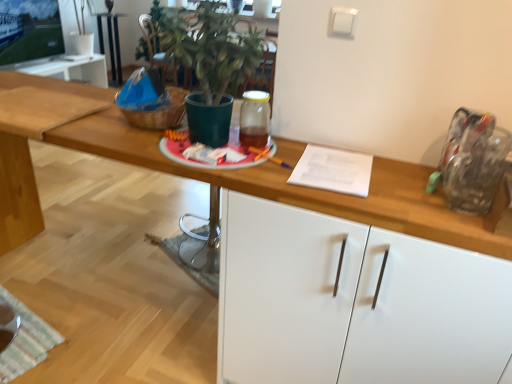
Describe the element at coordinates (354, 303) in the screenshot. I see `white glossy cabinet at center` at that location.

Find the location of a particular element. The image size is (512, 384). metallic silver table at center is located at coordinates coord(111,43).

Identify the location of white glossy cabinet at center. (354, 303).

Is white glossy cabinet at center spatially inside green matte plant pot at center, or outside of it?

white glossy cabinet at center is not inside green matte plant pot at center, it's outside.

Is white glossy cabinet at center smaller than green matte plant pot at center?

No.

Can you confirm if white glossy cabinet at center is thinner than green matte plant pot at center?

In fact, white glossy cabinet at center might be wider than green matte plant pot at center.

Is point (251, 208) closer or farther from the camera than point (229, 37)?

Point (251, 208) appears to be closer to the viewer than point (229, 37).

Is there a large distance between metallic silver table at center and white glossy cabinet at center?

Yes.

Does metallic silver table at center have a greater height compared to white glossy cabinet at center?

Answer: In fact, metallic silver table at center may be shorter than white glossy cabinet at center.

From a real-world perspective, is metallic silver table at center positioned above or below white glossy cabinet at center?

In terms of real-world spatial position, metallic silver table at center is below white glossy cabinet at center.

Is metallic silver table at center situated inside white glossy cabinet at center or outside?

metallic silver table at center is outside white glossy cabinet at center.

From the image's perspective, which object appears higher, green matte plant pot at center or metallic silver table at center?

From the image's view, metallic silver table at center is above.

From a real-world perspective, is green matte plant pot at center on top of metallic silver table at center?

Correct, in the physical world, green matte plant pot at center is higher than metallic silver table at center.

Between green matte plant pot at center and metallic silver table at center, which one appears on the right side from the viewer's perspective?

green matte plant pot at center.

Locate an element on the screen. The width and height of the screenshot is (512, 384). table located on the left of green matte plant pot at center is located at coordinates (111, 43).

Does green matte plant pot at center turn towards white glossy cabinet at center?

No.

Is green matte plant pot at center inside the boundaries of white glossy cabinet at center, or outside?

green matte plant pot at center exists outside the volume of white glossy cabinet at center.

From the image's perspective, is green matte plant pot at center above or below white glossy cabinet at center?

From the image's perspective, green matte plant pot at center appears above white glossy cabinet at center.

From a real-world perspective, relative to white glossy cabinet at center, is green matte plant pot at center vertically above or below?

In terms of real-world spatial position, green matte plant pot at center is above white glossy cabinet at center.

Does point (98, 14) appear closer or farther from the camera than point (224, 20)?

Point (98, 14) appears to be farther away from the viewer than point (224, 20).

Which of these two, metallic silver table at center or green matte plant pot at center, stands shorter?

Standing shorter between the two is green matte plant pot at center.

How different are the orientations of metallic silver table at center and green matte plant pot at center in degrees?

metallic silver table at center and green matte plant pot at center are facing 92 degrees away from each other.

Is metallic silver table at center closer to the viewer compared to green matte plant pot at center?

No, it is not.

Is white glossy cabinet at center turned away from metallic silver table at center?

white glossy cabinet at center is not turned away from metallic silver table at center.

From a real-world perspective, is white glossy cabinet at center positioned under metallic silver table at center based on gravity?

Incorrect, from a real-world perspective, white glossy cabinet at center is higher than metallic silver table at center.

Does white glossy cabinet at center come in front of metallic silver table at center?

Yes, the depth of white glossy cabinet at center is less than that of metallic silver table at center.

This screenshot has height=384, width=512. What are the coordinates of `cabinetry on the right of green matte plant pot at center` in the screenshot? It's located at (354, 303).

Identify the location of table behind the white glossy cabinet at center. The width and height of the screenshot is (512, 384). (111, 43).

When comparing their distances from white glossy cabinet at center, does green matte plant pot at center or metallic silver table at center seem closer?

Based on the image, green matte plant pot at center appears to be nearer to white glossy cabinet at center.

Based on their spatial positions, is green matte plant pot at center or white glossy cabinet at center further from metallic silver table at center?

white glossy cabinet at center is positioned further to the anchor metallic silver table at center.

Estimate the real-world distances between objects in this image. Which object is further from metallic silver table at center, white glossy cabinet at center or green matte plant pot at center?

white glossy cabinet at center.

From the image, which object appears to be nearer to green matte plant pot at center, metallic silver table at center or white glossy cabinet at center?

white glossy cabinet at center is positioned closer to the anchor green matte plant pot at center.

Consider the image. From the image, which object appears to be nearer to green matte plant pot at center, white glossy cabinet at center or metallic silver table at center?

white glossy cabinet at center is positioned closer to the anchor green matte plant pot at center.

Estimate the real-world distances between objects in this image. Which object is closer to white glossy cabinet at center, metallic silver table at center or green matte plant pot at center?

Among the two, green matte plant pot at center is located nearer to white glossy cabinet at center.

This screenshot has width=512, height=384. What are the coordinates of `houseplant between white glossy cabinet at center and metallic silver table at center along the z-axis` in the screenshot? It's located at (210, 65).